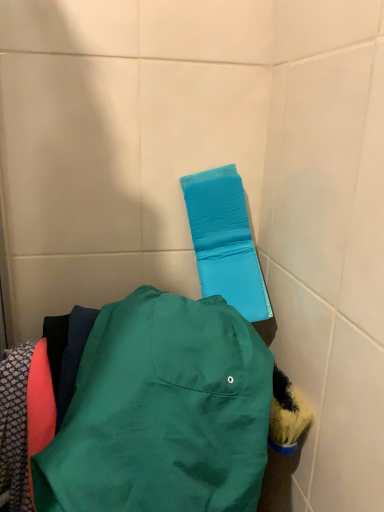
Question: Is blue fabric towel bar at upper center inside the boundaries of matte green jacket at center, or outside?

Choices:
 (A) outside
 (B) inside

Answer: (A)

Question: Is point tap(268, 302) closer or farther from the camera than point tap(110, 375)?

Choices:
 (A) closer
 (B) farther

Answer: (B)

Question: In terms of size, does blue fabric towel bar at upper center appear bigger or smaller than matte green jacket at center?

Choices:
 (A) big
 (B) small

Answer: (B)

Question: Considering the positions of point (119, 305) and point (220, 293), is point (119, 305) closer or farther from the camera than point (220, 293)?

Choices:
 (A) farther
 (B) closer

Answer: (B)

Question: From a real-world perspective, relative to blue fabric towel bar at upper center, is matte green jacket at center vertically above or below?

Choices:
 (A) above
 (B) below

Answer: (B)

Question: Is matte green jacket at center taller or shorter than blue fabric towel bar at upper center?

Choices:
 (A) tall
 (B) short

Answer: (B)

Question: From the image's perspective, is matte green jacket at center above or below blue fabric towel bar at upper center?

Choices:
 (A) above
 (B) below

Answer: (B)